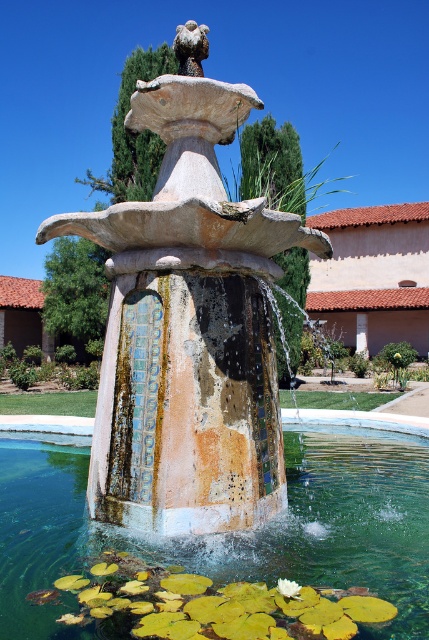
Which is below, mosaic stone fountain at center or translucent glass bowl at center?

translucent glass bowl at center is lower down.

Between point (184, 257) and point (334, 497), which one is positioned in front?

Point (184, 257) is in front.

Identify the location of mosaic stone fountain at center. (187, 323).